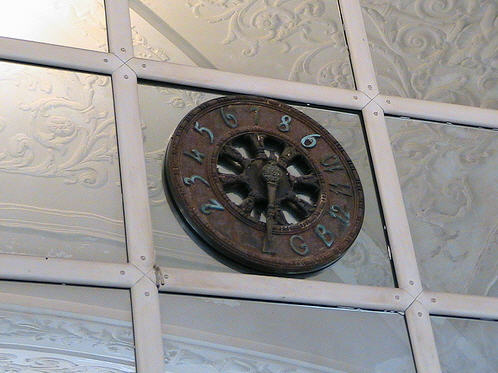
Image resolution: width=498 pixels, height=373 pixels. What are the coordinates of `reflection of the ceiling` in the screenshot? It's located at (59, 190), (282, 24), (425, 46), (452, 191), (234, 352), (53, 348).